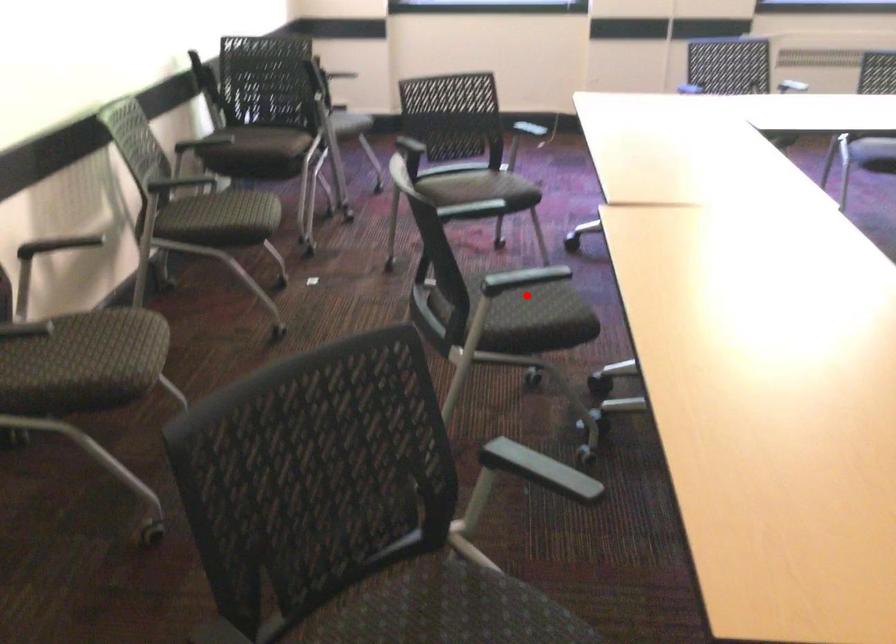
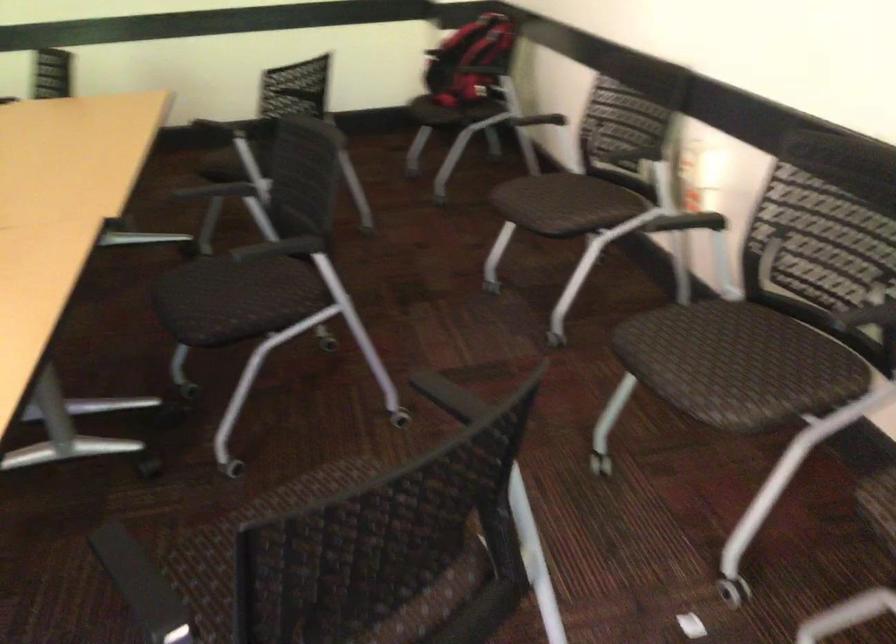
Where in the second image is the point corresponding to the highlighted location from the first image?

(222, 301)